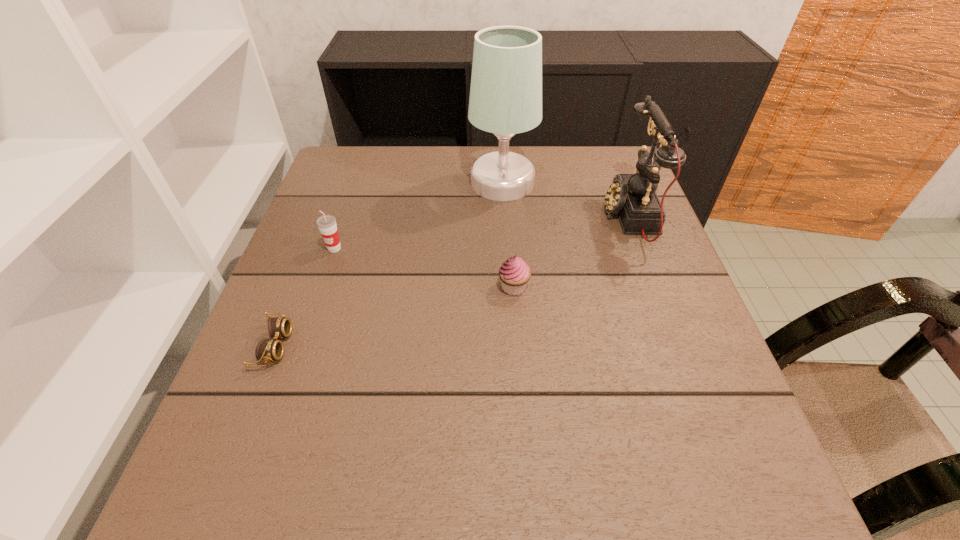
Where is `vacant area at the far right corner`? This screenshot has width=960, height=540. vacant area at the far right corner is located at coordinates (608, 163).

The image size is (960, 540). In order to click on vacant space at the near right corner of the desktop in this screenshot , I will do `click(667, 520)`.

Find the location of a particular element. unoccupied position between the second tallest object and the cup is located at coordinates (482, 232).

Where is `free space between the telephone and the second object from left to right`? free space between the telephone and the second object from left to right is located at coordinates (482, 232).

Locate an element on the screen. empty space between the second object from left to right and the goggles is located at coordinates (304, 297).

The width and height of the screenshot is (960, 540). In order to click on empty space between the fourth shortest object and the fourth object from right to left in this screenshot , I will do `click(482, 232)`.

Find the location of a particular element. This screenshot has width=960, height=540. unoccupied position between the cupcake and the shortest object is located at coordinates (395, 316).

Locate an element on the screen. The width and height of the screenshot is (960, 540). vacant area that lies between the third shortest object and the second tallest object is located at coordinates (482, 232).

Image resolution: width=960 pixels, height=540 pixels. Identify the location of empty location between the cupcake and the nearest object. (395, 316).

Locate an element on the screen. The image size is (960, 540). unoccupied position between the cupcake and the rightmost object is located at coordinates (572, 252).